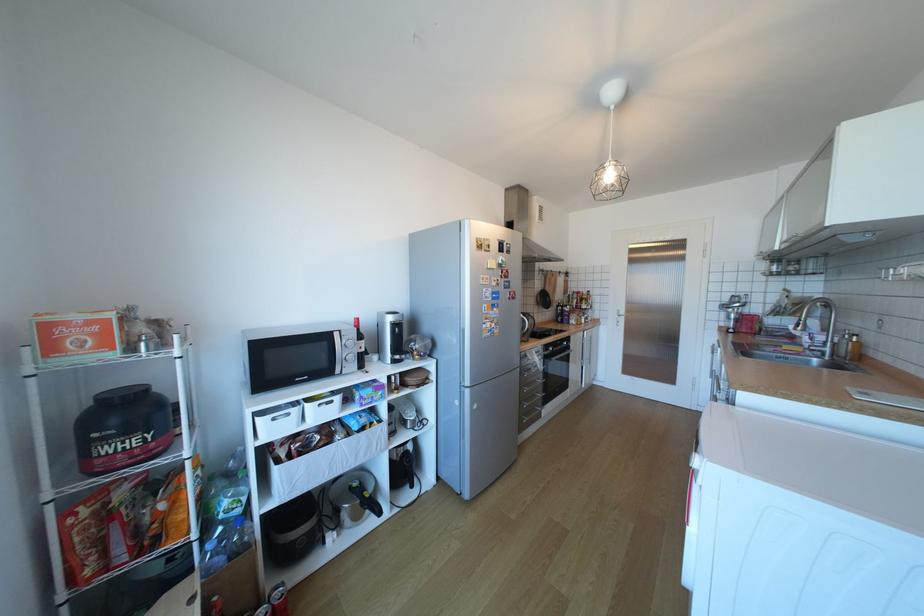
Where would you pull the refrigerator door handle? Please return your answer as a coordinate pair (x, y).

(463, 334)